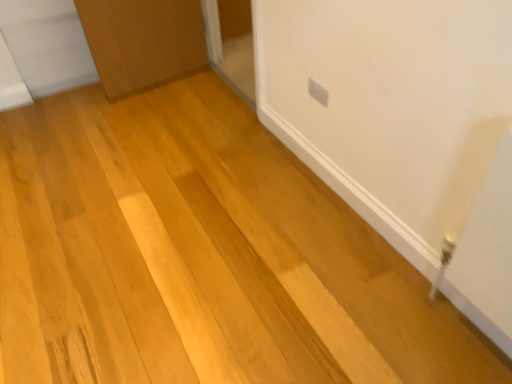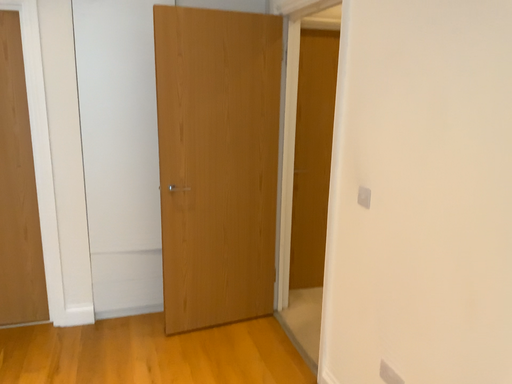
Question: Which way did the camera rotate in the video?

Choices:
 (A) rotated downward
 (B) rotated upward

Answer: (B)